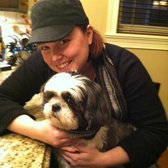
This screenshot has height=168, width=168. Identify the location of orange floor. (165, 160).